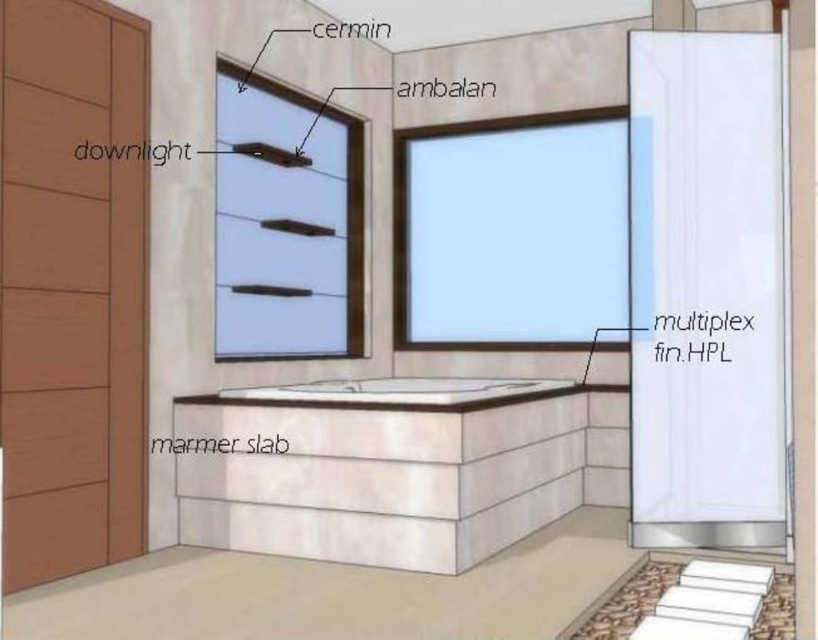
Question: Which point appears farthest from the camera in this image?

Choices:
 (A) (236, 250)
 (B) (582, 227)
 (C) (411, 388)

Answer: (B)

Question: Which object is positioned closest to the transparent glass window at upper center?

Choices:
 (A) white marble bath at center
 (B) transparent glass window at center

Answer: (A)

Question: Which of the following is the closest to the observer?

Choices:
 (A) (347, 296)
 (B) (556, 276)
 (C) (369, 403)

Answer: (C)

Question: Does transparent glass window at upper center appear on the left side of white marble bath at center?

Choices:
 (A) yes
 (B) no

Answer: (A)

Question: Can you confirm if transparent glass window at center is smaller than transparent glass window at upper center?

Choices:
 (A) no
 (B) yes

Answer: (B)

Question: Is transparent glass window at center above white marble bath at center?

Choices:
 (A) no
 (B) yes

Answer: (B)